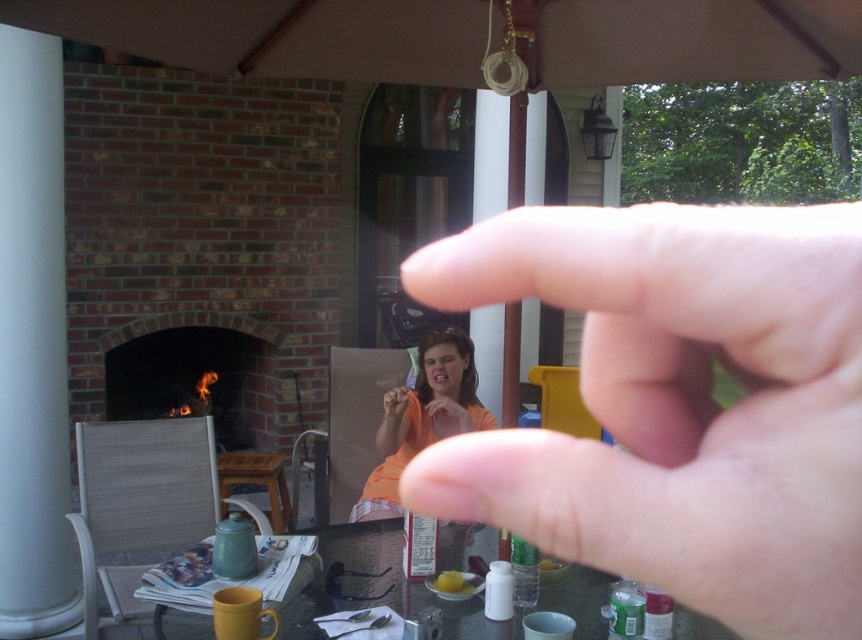
Question: Based on their relative distances, which object is nearer to the orange fabric shirt at center?

Choices:
 (A) flesh-toned skin at center
 (B) brick fireplace at center

Answer: (B)

Question: Can you confirm if brick fireplace at center is positioned to the left of yellow matte lemon at center?

Choices:
 (A) yes
 (B) no

Answer: (A)

Question: Can you confirm if flesh-toned skin at center is positioned below brick fireplace at center?

Choices:
 (A) no
 (B) yes

Answer: (A)

Question: Is flesh-toned skin at center positioned at the back of orange fabric shirt at center?

Choices:
 (A) no
 (B) yes

Answer: (A)

Question: Which point is farther to the camera?

Choices:
 (A) (454, 577)
 (B) (426, 406)
 (C) (676, 452)
 (D) (110, 364)

Answer: (D)

Question: Which of the following is the closest to the observer?

Choices:
 (A) yellow matte lemon at center
 (B) orange fabric shirt at center
 (C) brick fireplace at center

Answer: (A)